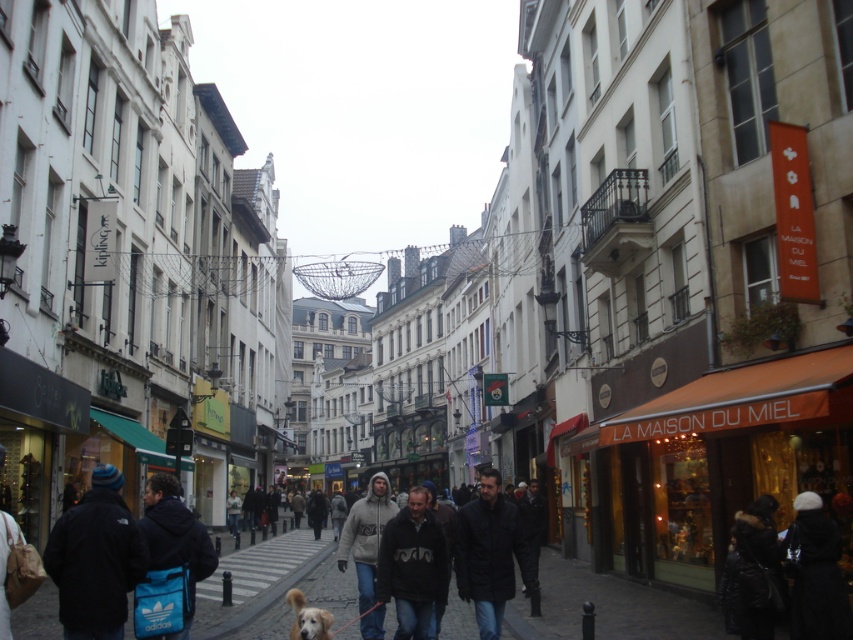
Does black matte jacket at center appear on the right side of golden fur dog at center?

Yes, black matte jacket at center is to the right of golden fur dog at center.

Who is positioned more to the right, black matte jacket at center or golden fur dog at center?

From the viewer's perspective, black matte jacket at center appears more on the right side.

What do you see at coordinates (412, 564) in the screenshot? I see `black matte jacket at center` at bounding box center [412, 564].

The image size is (853, 640). I want to click on black matte jacket at center, so click(412, 564).

Is black matte jacket at center thinner than blue fabric bag at lower left?

Correct, black matte jacket at center's width is less than blue fabric bag at lower left's.

Which is below, black matte jacket at center or blue fabric bag at lower left?

Positioned lower is black matte jacket at center.

Who is more forward, (384, 596) or (169, 637)?

Point (169, 637) is in front.

The height and width of the screenshot is (640, 853). What are the coordinates of `black matte jacket at center` in the screenshot? It's located at (412, 564).

Which of these two, dark blue fleece jacket at lower left or golden fur dog at center, stands taller?

With more height is dark blue fleece jacket at lower left.

Is dark blue fleece jacket at lower left to the left of golden fur dog at center from the viewer's perspective?

Correct, you'll find dark blue fleece jacket at lower left to the left of golden fur dog at center.

The height and width of the screenshot is (640, 853). What do you see at coordinates (96, 560) in the screenshot?
I see `dark blue fleece jacket at lower left` at bounding box center [96, 560].

At what (x,y) coordinates should I click in order to perform the action: click on dark blue fleece jacket at lower left. Please return your answer as a coordinate pair (x, y). Looking at the image, I should click on (96, 560).